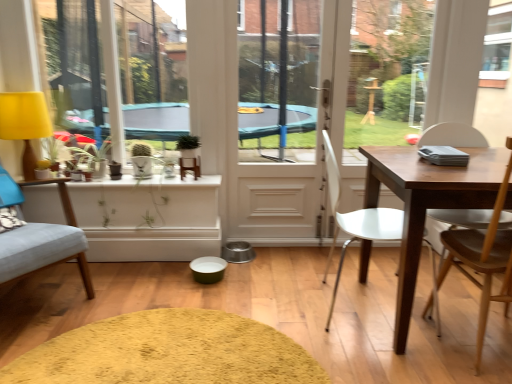
Identify the location of free point below white plastic chair at center, the 2th chair when ordered from right to left (from a real-world perspective). (343, 299).